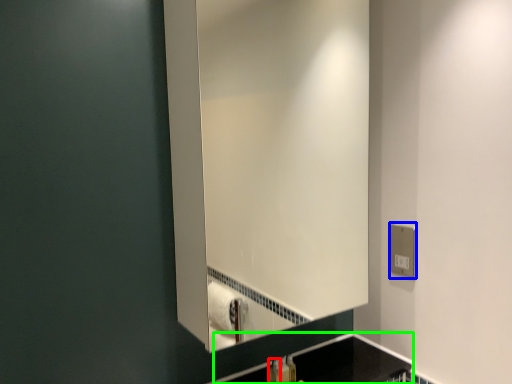
Question: Considering the real-world distances, which object is farthest from toiletry (highlighted by a red box)? electric outlet (highlighted by a blue box) or counter top (highlighted by a green box)?

Choices:
 (A) electric outlet
 (B) counter top

Answer: (A)